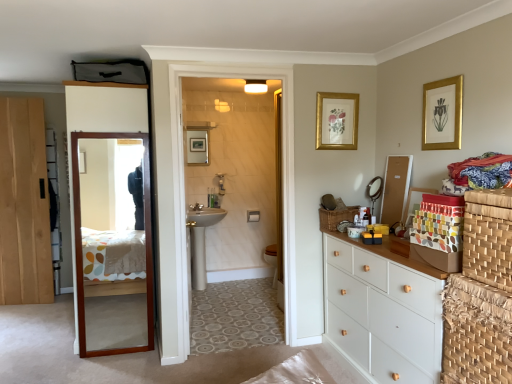
Describe the element at coordinates (337, 121) in the screenshot. I see `gold/glass picture frame at upper center, the first picture frame from the left` at that location.

Describe the element at coordinates (336, 217) in the screenshot. I see `woven brown basket at right, the second basket when ordered from bottom to top` at that location.

The width and height of the screenshot is (512, 384). What do you see at coordinates (24, 204) in the screenshot?
I see `natural wood door at left, which ranks as the second door in right-to-left order` at bounding box center [24, 204].

This screenshot has height=384, width=512. Describe the element at coordinates (482, 171) in the screenshot. I see `multicolored fabric at right` at that location.

Image resolution: width=512 pixels, height=384 pixels. What are the coordinates of `white wood chest of drawers at right` in the screenshot? It's located at (382, 313).

Considering the relative sizes of gold/golden picture frame at upper right, arranged as the 2th picture frame when viewed from the left, and brown wooden mirror at left, which is the first door in right-to-left order, in the image provided, is gold/golden picture frame at upper right, arranged as the 2th picture frame when viewed from the left, taller than brown wooden mirror at left, which is the first door in right-to-left order,?

Incorrect, the height of gold/golden picture frame at upper right, arranged as the 2th picture frame when viewed from the left, is not larger of that of brown wooden mirror at left, which is the first door in right-to-left order.

Is gold/golden picture frame at upper right, arranged as the 2th picture frame when viewed from the left, not near brown wooden mirror at left, placed as the second door when sorted from left to right?

Yes, gold/golden picture frame at upper right, arranged as the 2th picture frame when viewed from the left, and brown wooden mirror at left, placed as the second door when sorted from left to right, are quite far apart.

Is gold/golden picture frame at upper right, which is counted as the 2th picture frame, starting from the back, in front of brown wooden mirror at left, placed as the second door when sorted from left to right?

Yes.

From a real-world perspective, which object rests below the other?

brown wooden mirror at left, which is the first door in right-to-left order, is physically lower.

Considering the sizes of objects brown wooden mirror at left, placed as the second door when sorted from left to right, and woven brown basket at lower right, placed as the 1th basket when sorted from bottom to top, in the image provided, who is smaller, brown wooden mirror at left, placed as the second door when sorted from left to right, or woven brown basket at lower right, placed as the 1th basket when sorted from bottom to top,?

woven brown basket at lower right, placed as the 1th basket when sorted from bottom to top, is smaller.

Is point (68, 157) positioned behind point (490, 360)?

Yes, point (68, 157) is farther from viewer.

Would you say brown wooden mirror at left, which is the first door in right-to-left order, is a long distance from woven brown basket at lower right, which ranks as the 1th basket in front-to-back order?

Yes, brown wooden mirror at left, which is the first door in right-to-left order, and woven brown basket at lower right, which ranks as the 1th basket in front-to-back order, are quite far apart.

From the image's perspective, who appears lower, brown wooden mirror at left, placed as the second door when sorted from left to right, or woven brown basket at lower right, placed as the 1th basket when sorted from bottom to top?

woven brown basket at lower right, placed as the 1th basket when sorted from bottom to top, appears lower in the image.

Is brown woven basket at right taller or shorter than gold/golden picture frame at upper right, the first picture frame viewed from the front?

Clearly, brown woven basket at right is shorter compared to gold/golden picture frame at upper right, the first picture frame viewed from the front.

Are brown woven basket at right and gold/golden picture frame at upper right, which is counted as the first picture frame, starting from the right, beside each other?

No, brown woven basket at right is not with gold/golden picture frame at upper right, which is counted as the first picture frame, starting from the right.

Is brown woven basket at right inside or outside of gold/golden picture frame at upper right, arranged as the 2th picture frame when viewed from the left?

brown woven basket at right exists outside the volume of gold/golden picture frame at upper right, arranged as the 2th picture frame when viewed from the left.

Is brown woven basket at right facing away from gold/golden picture frame at upper right, which is counted as the 2th picture frame, starting from the back?

No.

From the image's perspective, who appears lower, matte silver faucet at center or woven brown basket at lower right, the 2th basket in the left-to-right sequence?

woven brown basket at lower right, the 2th basket in the left-to-right sequence, from the image's perspective.

From a real-world perspective, which is physically below, matte silver faucet at center or woven brown basket at lower right, the 2th basket in the left-to-right sequence?

woven brown basket at lower right, the 2th basket in the left-to-right sequence.

Is matte silver faucet at center in front of woven brown basket at lower right, which is the second basket from back to front?

No, matte silver faucet at center is behind woven brown basket at lower right, which is the second basket from back to front.

Identify the location of the 2nd basket counting from the right of the matte silver faucet at center. (476, 332).

Consider the image. From a real-world perspective, is matte silver faucet at center beneath multicolored fabric at right?

Yes.

Is point (192, 210) positioned behind point (496, 177)?

Yes, point (192, 210) is behind point (496, 177).

From the image's perspective, is matte silver faucet at center under multicolored fabric at right?

Yes, from the image's perspective, matte silver faucet at center is beneath multicolored fabric at right.

From the picture: Is white wood chest of drawers at right looking in the opposite direction of metallic round mirror at upper right?

No, white wood chest of drawers at right's orientation is not away from metallic round mirror at upper right.

Between white wood chest of drawers at right and metallic round mirror at upper right, which one has larger size?

Bigger between the two is white wood chest of drawers at right.

From a real-world perspective, does white wood chest of drawers at right sit lower than metallic round mirror at upper right?

Correct, in the physical world, white wood chest of drawers at right is lower than metallic round mirror at upper right.

Is white wood chest of drawers at right beside metallic round mirror at upper right?

white wood chest of drawers at right and metallic round mirror at upper right are not in contact.

Is matte silver faucet at center at the back of brown woven basket at right?

No, brown woven basket at right is not facing the opposite direction of matte silver faucet at center.

Based on the photo, can you tell me how much brown woven basket at right and matte silver faucet at center differ in facing direction?

The angle between the facing direction of brown woven basket at right and the facing direction of matte silver faucet at center is 87.4 degrees.

Where is `basket container in front of the matte silver faucet at center`? The width and height of the screenshot is (512, 384). basket container in front of the matte silver faucet at center is located at coordinates (488, 237).

Locate an element on the screen. The height and width of the screenshot is (384, 512). door that is the 2nd one below the gold/golden picture frame at upper right, the first picture frame viewed from the front (from a real-world perspective) is located at coordinates (103, 112).

I want to click on basket that is in front of the brown wooden mirror at left, placed as the second door when sorted from left to right, so click(476, 332).

Considering their positions, is brown wooden mirror at left, which is the first door in right-to-left order, positioned further to natural wood door at left, which ranks as the second door in right-to-left order, than multicolored fabric at right?

multicolored fabric at right.

From the image, which object appears to be nearer to brown woven basket at right, white wood chest of drawers at right or natural wood door at left, which ranks as the second door in right-to-left order?

white wood chest of drawers at right is positioned closer to the anchor brown woven basket at right.

Considering their positions, is gold/golden picture frame at upper right, arranged as the 2th picture frame when viewed from the left, positioned further to metallic round mirror at upper right than woven brown basket at right, which ranks as the first basket in top-to-bottom order?

gold/golden picture frame at upper right, arranged as the 2th picture frame when viewed from the left.

Estimate the real-world distances between objects in this image. Which object is closer to multicolored fabric at right, gold/glass picture frame at upper center, the first picture frame from the left, or matte white sink at center?

Based on the image, gold/glass picture frame at upper center, the first picture frame from the left, appears to be nearer to multicolored fabric at right.

Which object lies nearer to the anchor point gold/glass picture frame at upper center, the 2th picture frame when ordered from right to left, gold/golden picture frame at upper right, the first picture frame viewed from the front, or natural wood door at left, which ranks as the second door in right-to-left order?

The object closer to gold/glass picture frame at upper center, the 2th picture frame when ordered from right to left, is gold/golden picture frame at upper right, the first picture frame viewed from the front.

Based on their spatial positions, is gold/golden picture frame at upper right, arranged as the 2th picture frame when viewed from the left, or matte white sink at center closer to matte silver faucet at center?

matte white sink at center is closer to matte silver faucet at center.

Estimate the real-world distances between objects in this image. Which object is closer to matte silver faucet at center, multicolored fabric at right or woven brown basket at right, which is the 1th basket from left to right?

woven brown basket at right, which is the 1th basket from left to right, is closer to matte silver faucet at center.

Estimate the real-world distances between objects in this image. Which object is closer to brown wooden mirror at left, placed as the second door when sorted from left to right, matte silver faucet at center or gold/glass picture frame at upper center, the first picture frame from the left?

gold/glass picture frame at upper center, the first picture frame from the left, is positioned closer to the anchor brown wooden mirror at left, placed as the second door when sorted from left to right.

In order to click on door between brown wooden mirror at left, placed as the second door when sorted from left to right, and matte silver faucet at center from front to back in this screenshot , I will do `click(24, 204)`.

Locate an element on the screen. This screenshot has width=512, height=384. laundry positioned between brown woven basket at right and gold/golden picture frame at upper right, the first picture frame viewed from the front, from near to far is located at coordinates (482, 171).

The height and width of the screenshot is (384, 512). Identify the location of mirror between brown woven basket at right and matte silver faucet at center along the z-axis. (374, 192).

Where is `basket between woven brown basket at lower right, which is the second basket from back to front, and matte white sink at center in the front-back direction`? Image resolution: width=512 pixels, height=384 pixels. basket between woven brown basket at lower right, which is the second basket from back to front, and matte white sink at center in the front-back direction is located at coordinates (336, 217).